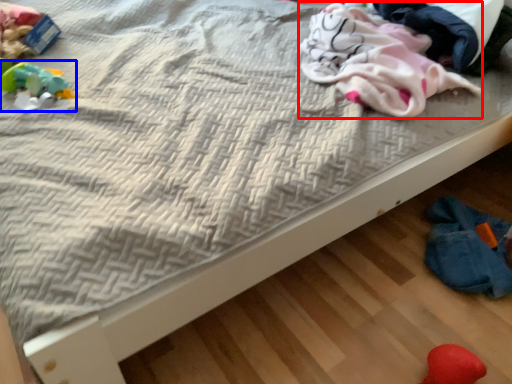
Question: Among these objects, which one is farthest to the camera, material (highlighted by a red box) or toy (highlighted by a blue box)?

Choices:
 (A) material
 (B) toy

Answer: (B)